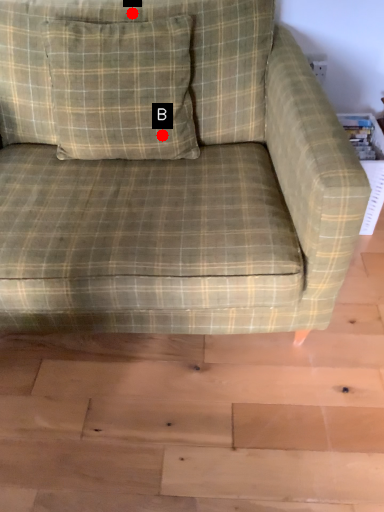
Question: Two points are circled on the image, labeled by A and B beside each circle. Among these points, which one is nearest to the camera?

Choices:
 (A) A is closer
 (B) B is closer

Answer: (A)